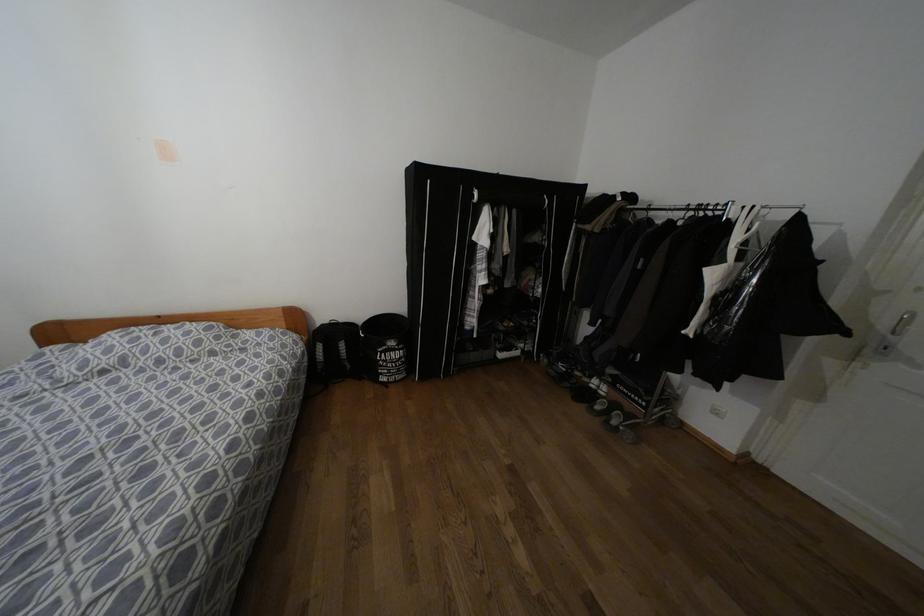
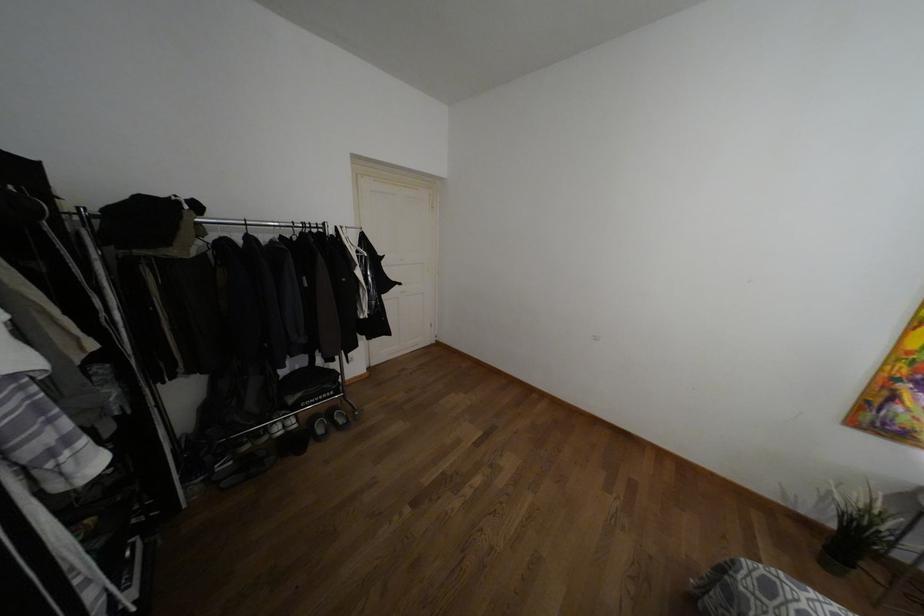
Where in the second image is the point corresponding to pixel 577 373 from the first image?

(246, 447)